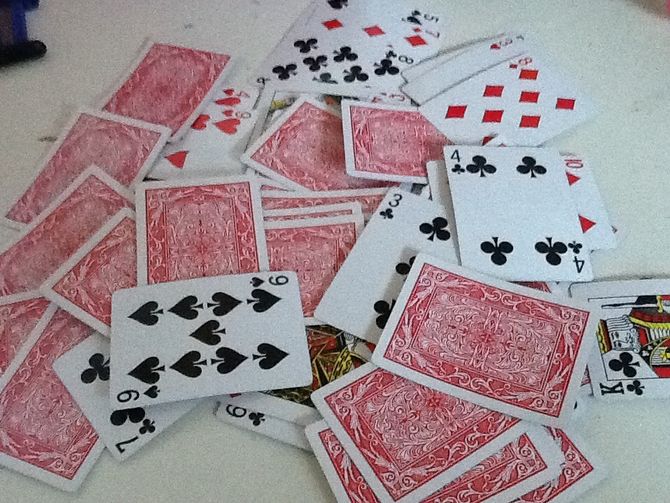
Locate an element on the screen. Image resolution: width=670 pixels, height=503 pixels. spot on table top is located at coordinates (47, 137).